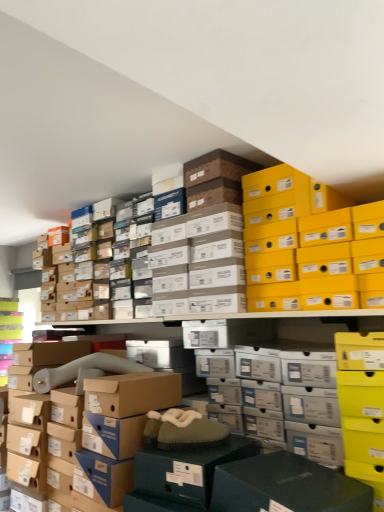
Question: From the image's perspective, relative to brown cardboard box at center, which appears as the first storage box when ordered from the bottom, is yellow matte shoebox at upper right, the second storage box viewed from the left, above or below?

Choices:
 (A) below
 (B) above

Answer: (B)

Question: Based on their positions, is yellow matte shoebox at upper right, the first storage box in the right-to-left sequence, located to the left or right of brown cardboard box at center, acting as the second storage box starting from the top?

Choices:
 (A) right
 (B) left

Answer: (A)

Question: Considering their positions, is yellow matte shoebox at upper right, the second storage box viewed from the left, located in front of or behind brown cardboard box at center, which appears as the first storage box when ordered from the bottom?

Choices:
 (A) behind
 (B) front

Answer: (B)

Question: From the image's perspective, is brown cardboard box at center, acting as the second storage box starting from the top, above or below yellow matte shoebox at upper right, the first storage box in the right-to-left sequence?

Choices:
 (A) below
 (B) above

Answer: (A)

Question: Considering the positions of point (130, 379) and point (304, 268), is point (130, 379) closer or farther from the camera than point (304, 268)?

Choices:
 (A) closer
 (B) farther

Answer: (A)

Question: From a real-world perspective, is brown cardboard box at center, acting as the second storage box starting from the top, positioned above or below yellow matte shoebox at upper right, which appears as the 1th storage box when viewed from the top?

Choices:
 (A) below
 (B) above

Answer: (A)

Question: In the image, is brown cardboard box at center, positioned as the 2th storage box in right-to-left order, positioned in front of or behind yellow matte shoebox at upper right, the second storage box viewed from the left?

Choices:
 (A) behind
 (B) front

Answer: (A)